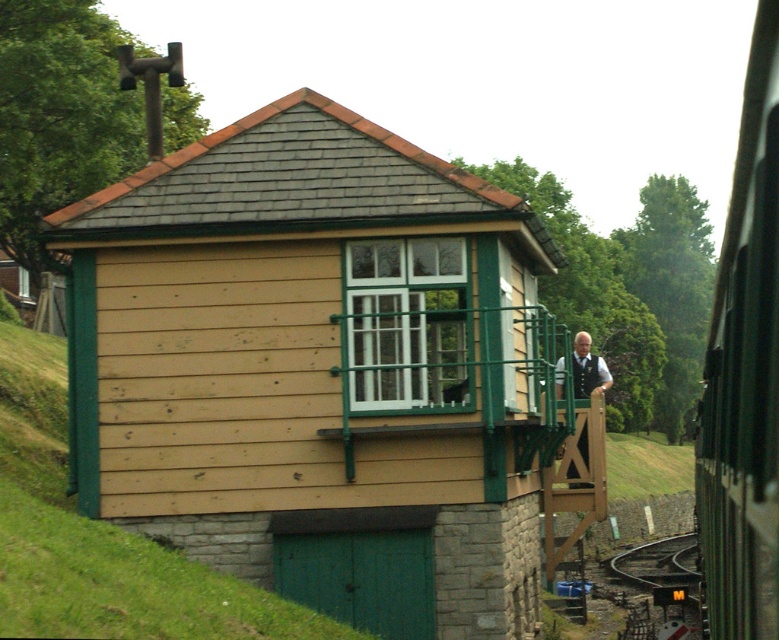
You are a maintenance worker who needs to replace the window. You have a ladder that is 28 inches long. Can you safely reach the white plastic window at center from the beige wood shed at center without moving the ladder?

The distance between the beige wood shed at center and the white plastic window at center is 30.01 inches. Since the ladder is only 28 inches long, it is not long enough to reach the window safely. You will need a longer ladder.

You are a maintenance worker needing to access the white plastic window at center for repairs. The beige wood shed at center is blocking your path. Can you walk around the shed to reach the window?

The beige wood shed at center is in front of the white plastic window at center, so you cannot directly access the window. However, you can walk around the shed to reach the window from the side or back.